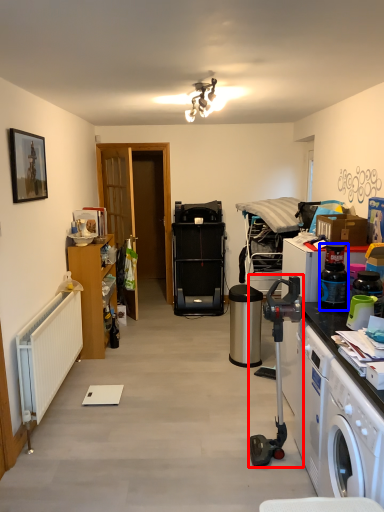
Question: Which of the following is the farthest to the observer, appliance (highlighted by a red box) or bottle (highlighted by a blue box)?

Choices:
 (A) appliance
 (B) bottle

Answer: (B)